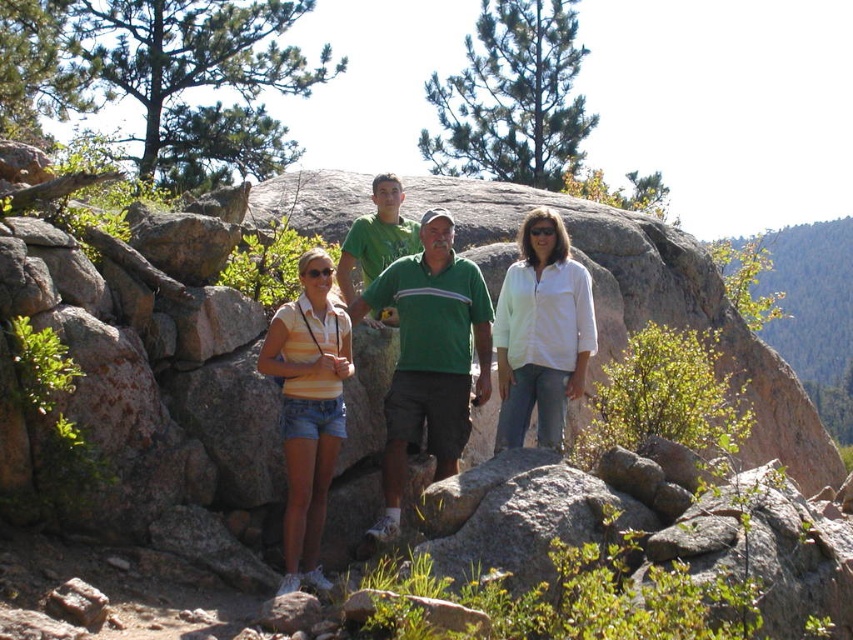
Consider the image. You are a photographer trying to capture a group photo of the two adults and two children. You notice the green cotton polo shirt at center and the yellow striped shirt at center. Which shirt should you focus on to ensure the subject wearing it is clearly visible in the photo?

The green cotton polo shirt at center is larger in size than the yellow striped shirt at center, so focusing on the green cotton polo shirt at center will ensure the subject wearing it is clearly visible in the photo.

You are a photographer trying to capture a group photo of the striped cotton shirt at center and the yellow striped shirt at center. Since you want both shirts to appear the same size in the photo, which direction should you move your camera?

To make the striped cotton shirt at center and the yellow striped shirt at center appear the same size in the photo, you should move the camera closer to the striped cotton shirt at center because it is larger in size than the yellow striped shirt at center.

In the scene shown: You are a photographer trying to capture a clear shot of the striped cotton shirt at center and the white cotton shirt at center. Which one is closer to the camera, based on their positions in the scene?

The striped cotton shirt at center is closer to the camera because it is in front of the white cotton shirt at center.